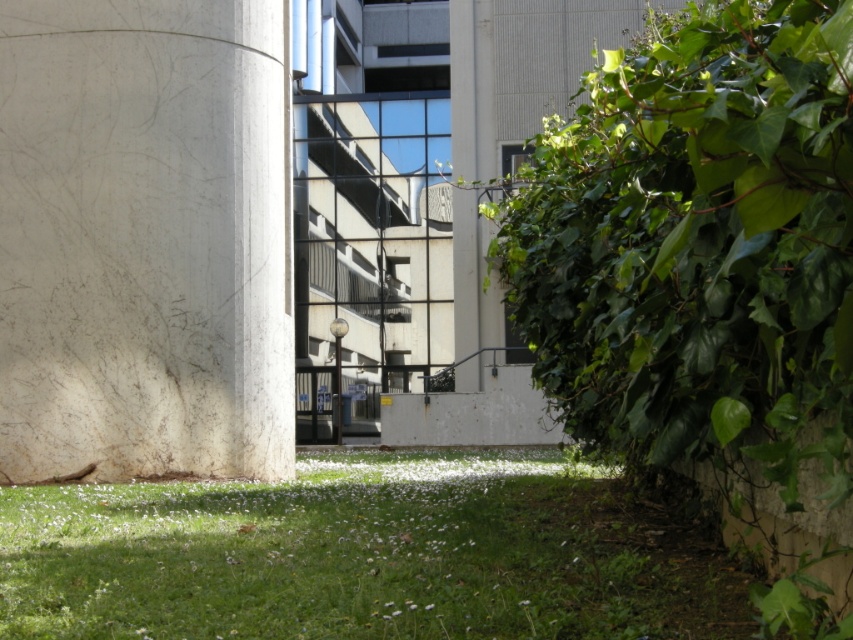
Is white marble pillar at left closer to the viewer compared to white smooth pillar at center?

Yes, it is in front of white smooth pillar at center.

Image resolution: width=853 pixels, height=640 pixels. Identify the location of white marble pillar at left. (144, 237).

Does point (827, 10) come closer to viewer compared to point (546, 470)?

That is True.

Does point (764, 168) lie behind point (53, 612)?

No, it is in front of (53, 612).

The width and height of the screenshot is (853, 640). In order to click on green leafy hedge at right in this screenshot , I will do `click(697, 246)`.

Who is lower down, green grass at lower center or white smooth pillar at center?

Positioned lower is green grass at lower center.

Does point (0, 634) lie behind point (486, 177)?

That is False.

Find the location of a particular element. green grass at lower center is located at coordinates (363, 556).